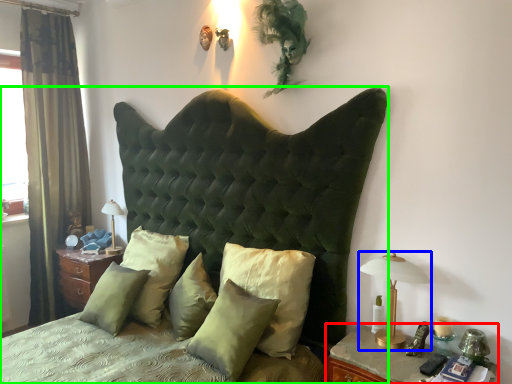
Question: Which object is positioned closest to nightstand (highlighted by a red box)? Select from bedside lamp (highlighted by a blue box) and bed (highlighted by a green box).

Choices:
 (A) bedside lamp
 (B) bed

Answer: (A)